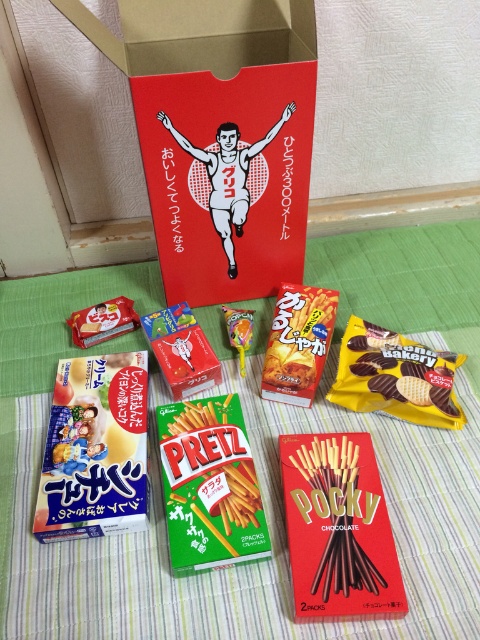
Does red matte cardboard box at upper center appear on the right side of yellow chocolate wafer at center?

In fact, red matte cardboard box at upper center is to the left of yellow chocolate wafer at center.

Which of these two, red matte cardboard box at upper center or yellow chocolate wafer at center, stands taller?

red matte cardboard box at upper center is taller.

Which is behind, point (226, 208) or point (429, 364)?

Positioned behind is point (226, 208).

Locate an element on the screen. This screenshot has width=480, height=640. red matte cardboard box at upper center is located at coordinates (217, 132).

Is chocolate-coated sticks at center wider than matte orange candy at center?

Yes, chocolate-coated sticks at center is wider than matte orange candy at center.

Who is shorter, chocolate-coated sticks at center or matte orange candy at center?

Standing shorter between the two is chocolate-coated sticks at center.

Which is behind, point (374, 508) or point (302, 404)?

Point (302, 404)

You are a GUI agent. You are given a task and a screenshot of the screen. Output one action in this format:
    pyautogui.click(x=<x>, y=<y>)
    Task: Click on the chocolate-coated sticks at center
    
    Given the screenshot: What is the action you would take?
    pyautogui.click(x=338, y=529)

Is point (298, 308) positioned before point (82, 330)?

That is True.

Which is in front, point (266, 353) or point (79, 326)?

Positioned in front is point (266, 353).

Find the location of a particular element. The image size is (480, 640). matte orange candy at center is located at coordinates (298, 342).